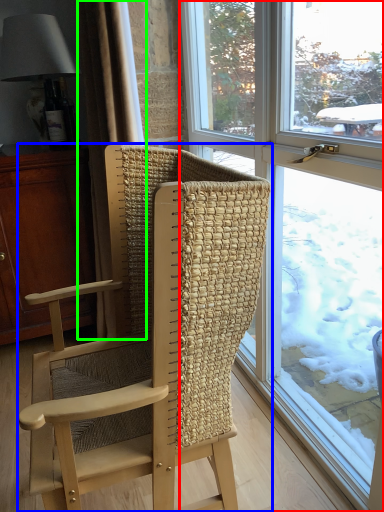
Question: Which object is positioned closest to window (highlighted by a red box)? Select from chair (highlighted by a blue box) and curtain (highlighted by a green box).

Choices:
 (A) chair
 (B) curtain

Answer: (A)